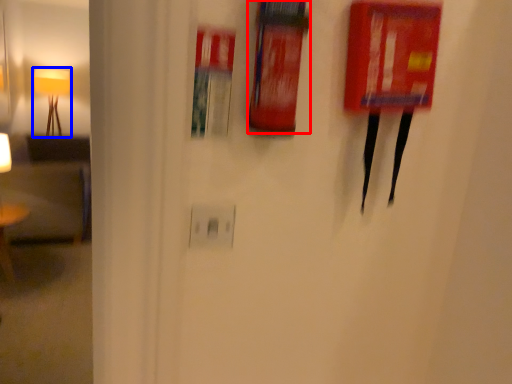
Question: Which of the following is the farthest to the observer, extinguisher (highlighted by a red box) or lamp (highlighted by a blue box)?

Choices:
 (A) extinguisher
 (B) lamp

Answer: (B)